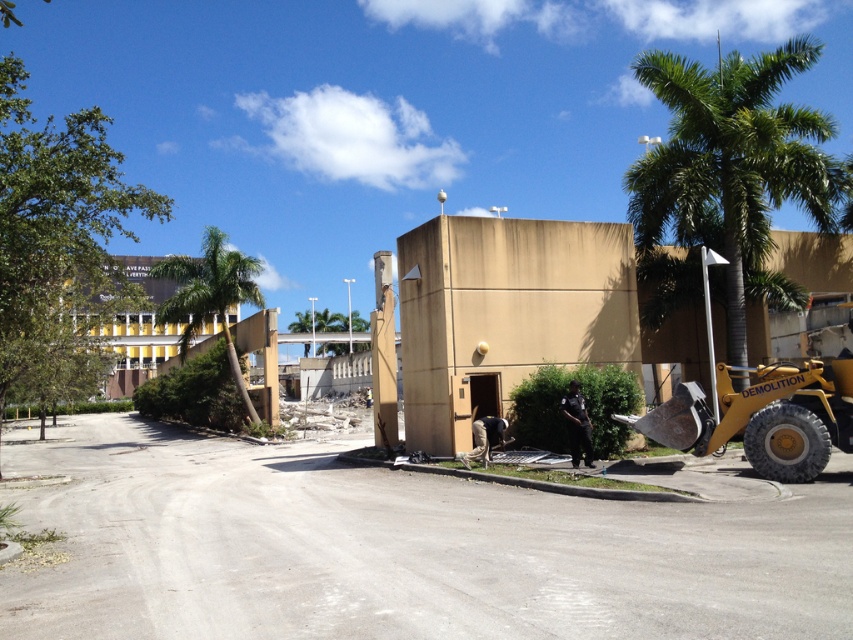
You are standing at the construction site and want to place a safety barrier between the two points labeled point (706, 122) and point (670, 413). Which point should the barrier be closer to in order to block the path towards the machinery?

The barrier should be closer to point (670, 413) because it is closer to the viewer than point (706, 122), making it the better position to block the path towards the machinery.

You are a landscape architect designing a garden path between the green leafy palm tree at upper right and the green leafy palm tree at left. Which tree requires a wider path to accommodate its width?

The green leafy palm tree at upper right requires a wider path because its width surpasses the green leafy palm tree at left.